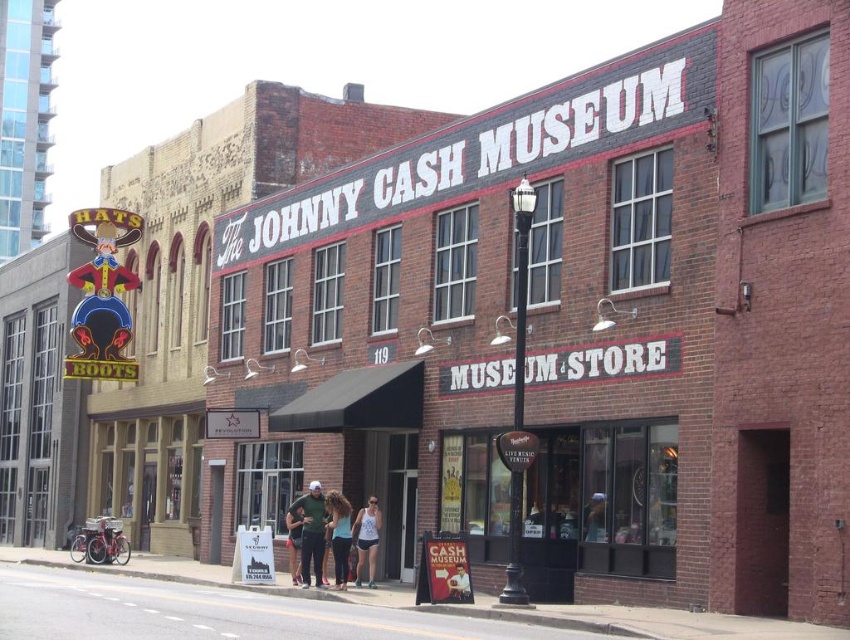
Can you confirm if metallic silver bicycle at lower left is bigger than green cotton shirt at center?

Indeed, metallic silver bicycle at lower left has a larger size compared to green cotton shirt at center.

Who is more distant from viewer, (170, 417) or (292, 524)?

Positioned behind is point (170, 417).

Where is `metallic silver bicycle at lower left`? Image resolution: width=850 pixels, height=640 pixels. metallic silver bicycle at lower left is located at coordinates coord(149,472).

Is green cotton shirt at center above matte blue shorts at center?

Yes.

Can you confirm if green cotton shirt at center is smaller than matte blue shorts at center?

Yes, green cotton shirt at center is smaller than matte blue shorts at center.

Who is more forward, (306, 582) or (349, 529)?

Point (349, 529) is in front.

Where is `green cotton shirt at center`? green cotton shirt at center is located at coordinates (309, 531).

Consider the image. Does matte glass window at center appear on the right side of green cotton shirt at center?

Yes, matte glass window at center is to the right of green cotton shirt at center.

Who is more forward, (573, 531) or (323, 547)?

Point (573, 531)

Where is `matte glass window at center`? matte glass window at center is located at coordinates (599, 506).